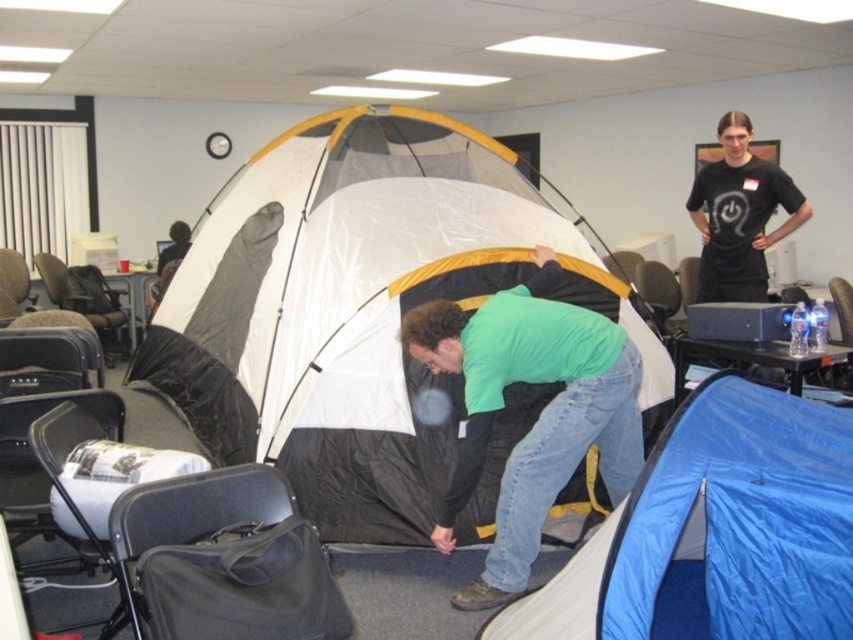
Between white matte tent at center and black t-shirt at upper right, which one is positioned lower?

white matte tent at center

Which is above, white matte tent at center or black t-shirt at upper right?

black t-shirt at upper right is above.

Does point (306, 161) come behind point (721, 240)?

Yes, it is behind point (721, 240).

The width and height of the screenshot is (853, 640). I want to click on white matte tent at center, so click(357, 307).

Looking at this image, is the position of white matte tent at center more distant than that of blue tarp at lower right?

Yes, it is behind blue tarp at lower right.

Who is positioned more to the right, white matte tent at center or blue tarp at lower right?

From the viewer's perspective, blue tarp at lower right appears more on the right side.

Does point (263, 317) come farther from viewer compared to point (611, 531)?

Yes, it is behind point (611, 531).

Where is `white matte tent at center`? The height and width of the screenshot is (640, 853). white matte tent at center is located at coordinates (357, 307).

Which of these two, green matte shirt at center or black t-shirt at upper right, stands taller?

With more height is green matte shirt at center.

You are a GUI agent. You are given a task and a screenshot of the screen. Output one action in this format:
    pyautogui.click(x=<x>, y=<y>)
    Task: Click on the green matte shirt at center
    
    Given the screenshot: What is the action you would take?
    pyautogui.click(x=538, y=416)

This screenshot has height=640, width=853. Find the location of `green matte shirt at center`. green matte shirt at center is located at coordinates (538, 416).